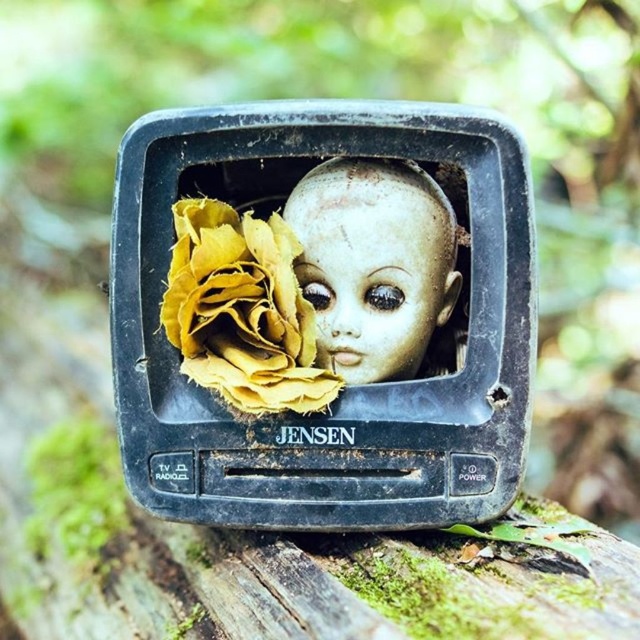
Question: Among these points, which one is nearest to the camera?

Choices:
 (A) (241, 381)
 (B) (362, 262)

Answer: (A)

Question: Observing the image, what is the correct spatial positioning of yellow crumpled paper at center in reference to pale porcelain face at center?

Choices:
 (A) below
 (B) above

Answer: (A)

Question: Is the position of yellow crumpled paper at center less distant than that of pale porcelain face at center?

Choices:
 (A) yes
 (B) no

Answer: (A)

Question: Does yellow crumpled paper at center have a lesser width compared to pale porcelain face at center?

Choices:
 (A) yes
 (B) no

Answer: (A)

Question: Among these points, which one is nearest to the camera?

Choices:
 (A) (275, 305)
 (B) (444, 275)

Answer: (A)